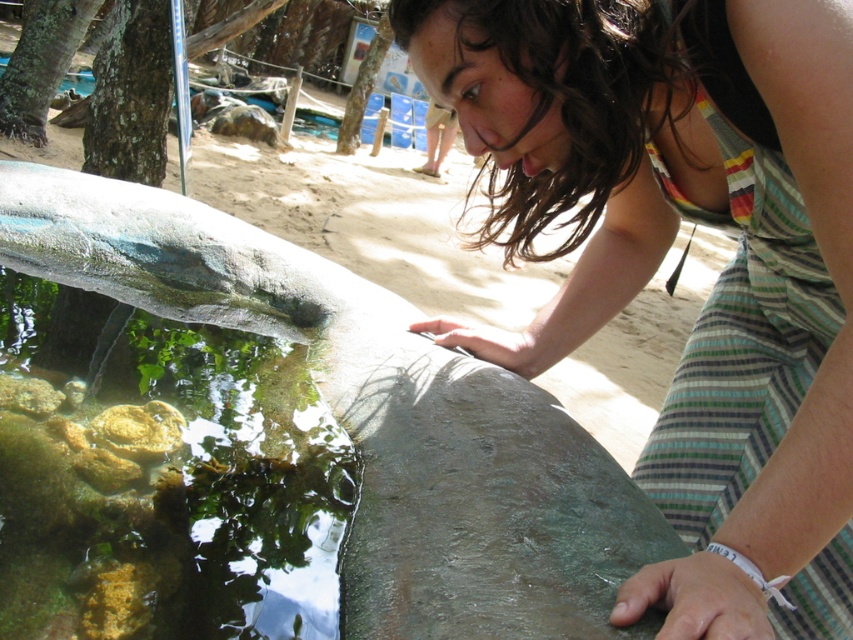
Question: Is striped fabric dress at center positioned at the back of clear glass fish pond at lower left?

Choices:
 (A) yes
 (B) no

Answer: (B)

Question: Which point appears farthest from the camera in this image?

Choices:
 (A) (669, 552)
 (B) (608, 214)
 (C) (148, 596)

Answer: (B)

Question: Does striped fabric dress at center have a greater width compared to smooth stone fish at center?

Choices:
 (A) no
 (B) yes

Answer: (A)

Question: Which point appears closest to the camera in this image?

Choices:
 (A) (548, 512)
 (B) (93, 433)
 (C) (605, 252)

Answer: (A)

Question: Which of the following is the farthest from the observer?

Choices:
 (A) striped fabric dress at center
 (B) smooth stone fish at center

Answer: (B)

Question: Is striped fabric dress at center closer to the viewer compared to clear glass fish pond at lower left?

Choices:
 (A) no
 (B) yes

Answer: (B)